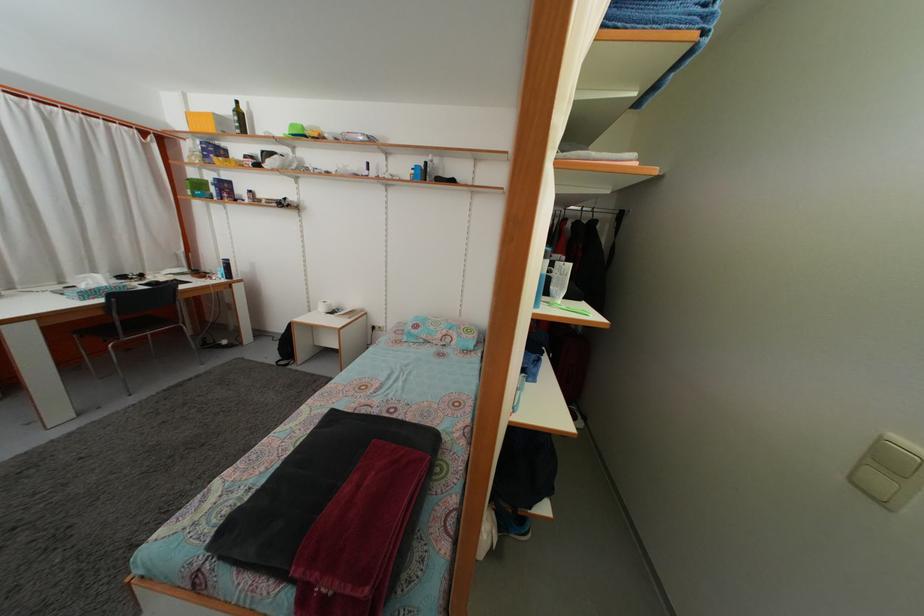
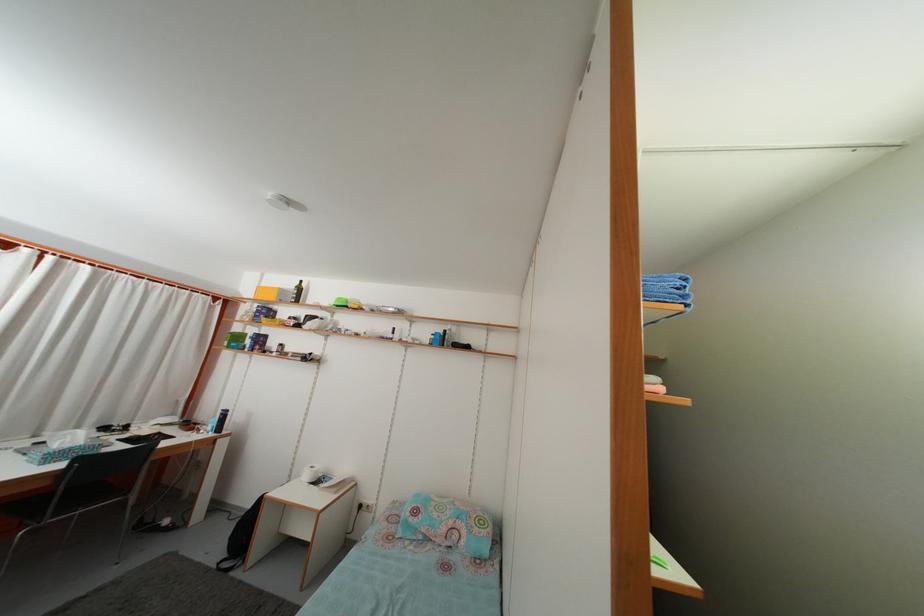
Question: The images are taken continuously from a first-person perspective. In which direction is your viewpoint rotating?

Choices:
 (A) Left
 (B) Right
 (C) Up
 (D) Down

Answer: (C)